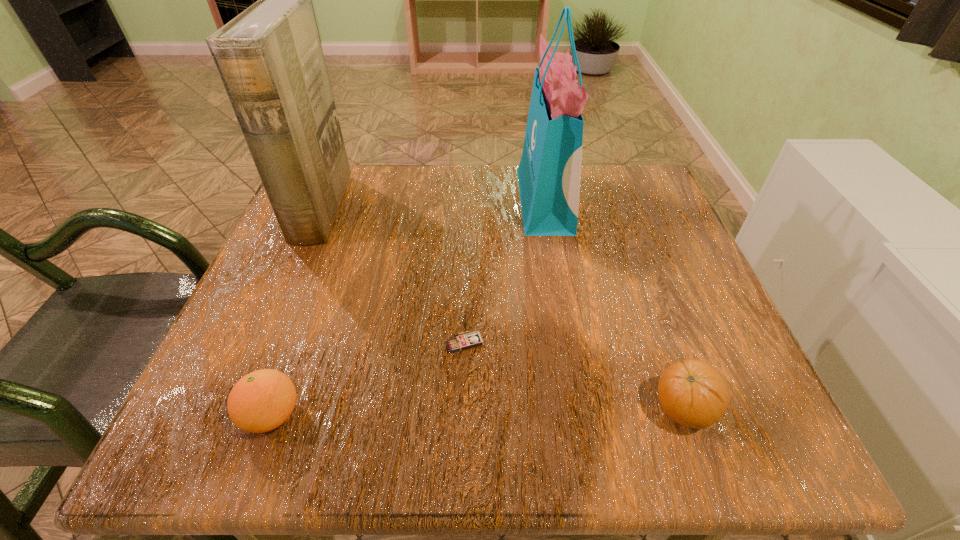
Locate an element on the screen. Image resolution: width=960 pixels, height=540 pixels. free location located on the right of the left orange is located at coordinates (483, 415).

Locate an element on the screen. The width and height of the screenshot is (960, 540). shopping bag located in the far edge section of the desktop is located at coordinates (549, 173).

This screenshot has width=960, height=540. Find the location of `phonebook located in the far edge section of the desktop`. phonebook located in the far edge section of the desktop is located at coordinates (270, 60).

The height and width of the screenshot is (540, 960). Find the location of `phonebook that is at the left edge`. phonebook that is at the left edge is located at coordinates (x=270, y=60).

Locate an element on the screen. orange located at the left edge is located at coordinates (262, 400).

Locate an element on the screen. Image resolution: width=960 pixels, height=540 pixels. object located at the right edge is located at coordinates (693, 393).

Find the location of a particular element. object present at the far left corner is located at coordinates (270, 60).

This screenshot has width=960, height=540. What are the coordinates of `object at the near left corner` in the screenshot? It's located at (262, 400).

Locate an element on the screen. The height and width of the screenshot is (540, 960). object that is positioned at the near right corner is located at coordinates [693, 393].

Find the location of a particular element. vacant space at the far edge is located at coordinates (434, 164).